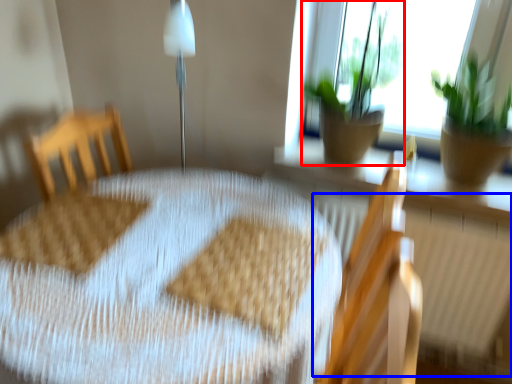
Question: Which object appears closest to the camera in this image, houseplant (highlighted by a red box) or radiator (highlighted by a blue box)?

Choices:
 (A) houseplant
 (B) radiator

Answer: (A)